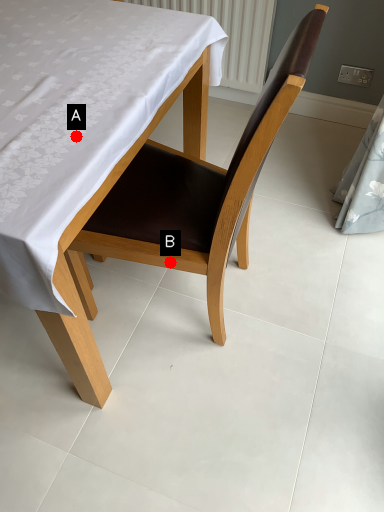
Question: Two points are circled on the image, labeled by A and B beside each circle. Which point is closer to the camera?

Choices:
 (A) A is closer
 (B) B is closer

Answer: (A)